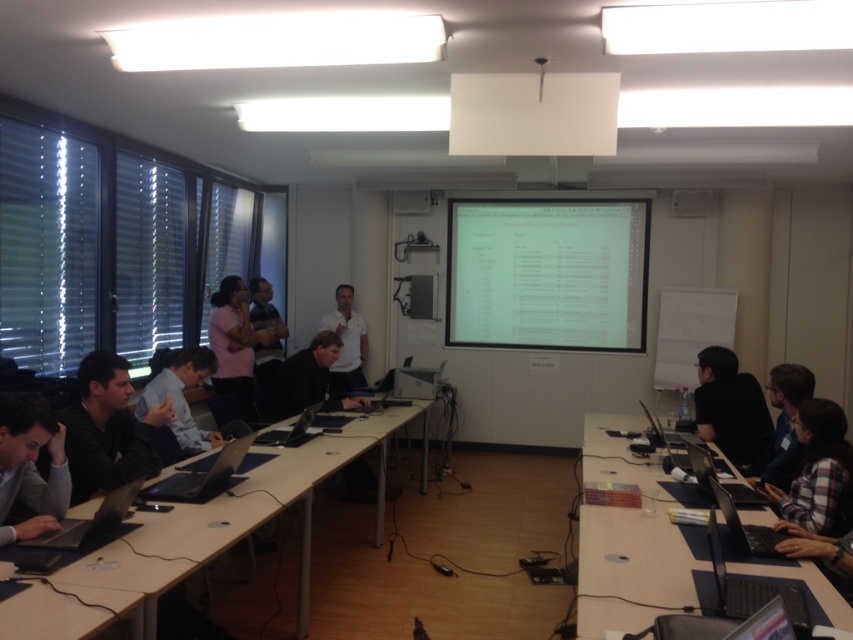
You are a person who is 1.7 meters tall and standing in the conference room. You want to place a 1.8 meter long banner on the wall behind the black plastic table at lower right. Can you reach the top of the banner if you stand on the matte black laptop at left?

The black plastic table at lower right has a lesser height compared to matte black laptop at left. Since the laptop is taller, standing on it would give you an additional height. Your total height would be 1.7 meters plus the height of the laptop. However, the exact height of the laptop isn

You are standing in the conference room and want to find the gray fabric shirt at lower left. Where exactly is it located in the room?

The gray fabric shirt at lower left is located at point (30, 465) in the room.

You are standing in the conference room and want to hand a document to the person wearing the gray fabric shirt at lower left. However, there is a black plastic laptop at center in the way. Can you reach the person without moving the laptop?

The gray fabric shirt at lower left is closer to the viewer than the black plastic laptop at center, so you can reach the person without moving the laptop because the shirt is in front of the laptop.